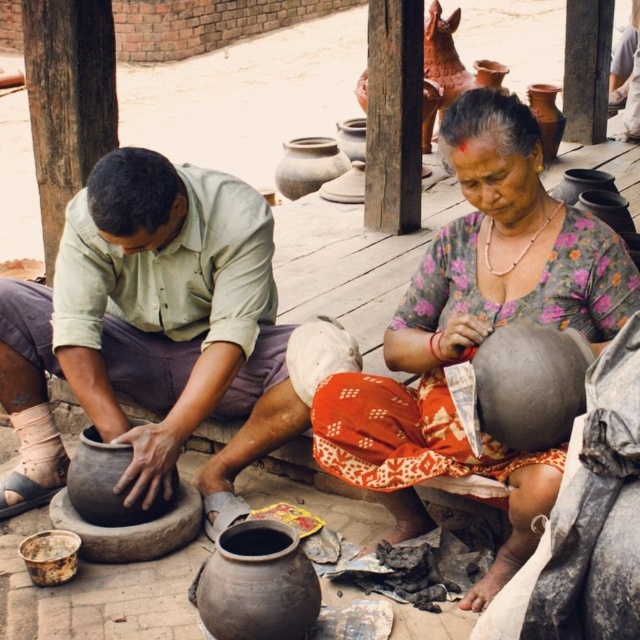
Question: Which point is farther to the camera?

Choices:
 (A) (65, 547)
 (B) (232, 500)

Answer: (B)

Question: Which point appears farthest from the camera in this image?

Choices:
 (A) (48, 568)
 (B) (461, 301)
 (C) (221, 291)

Answer: (C)

Question: Where is matte gray pot at center located in relation to rusty metal bucket at lower left in the image?

Choices:
 (A) right
 (B) left

Answer: (A)

Question: Which object is closer to the camera taking this photo?

Choices:
 (A) matte clay pot at center
 (B) matte clay pot at left

Answer: (A)

Question: Can you confirm if matte gray pot at center is positioned to the right of rusty metal bucket at lower left?

Choices:
 (A) yes
 (B) no

Answer: (A)

Question: Can you confirm if matte clay pot at left is positioned below rusty metal bucket at lower left?

Choices:
 (A) no
 (B) yes

Answer: (A)